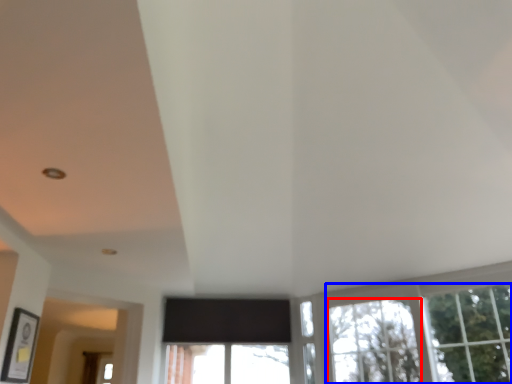
Question: Which of the following is the farthest to the observer, window (highlighted by a red box) or tree (highlighted by a blue box)?

Choices:
 (A) window
 (B) tree

Answer: (A)